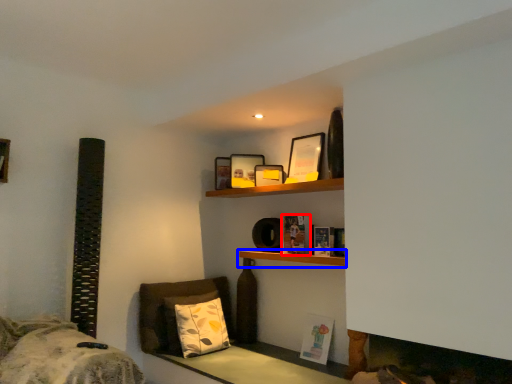
Question: Which point is further to the camera, book (highlighted by a red box) or shelf (highlighted by a blue box)?

Choices:
 (A) book
 (B) shelf

Answer: (A)